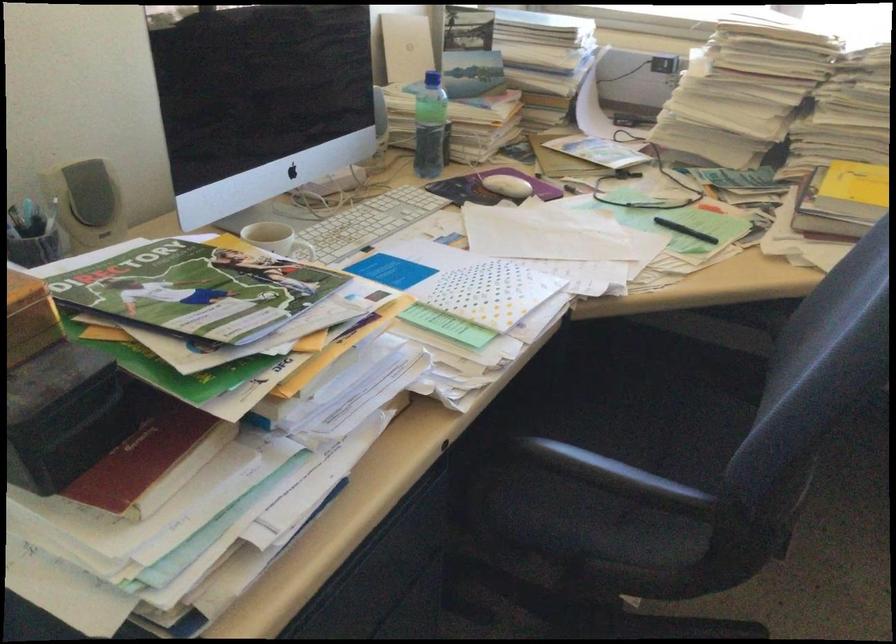
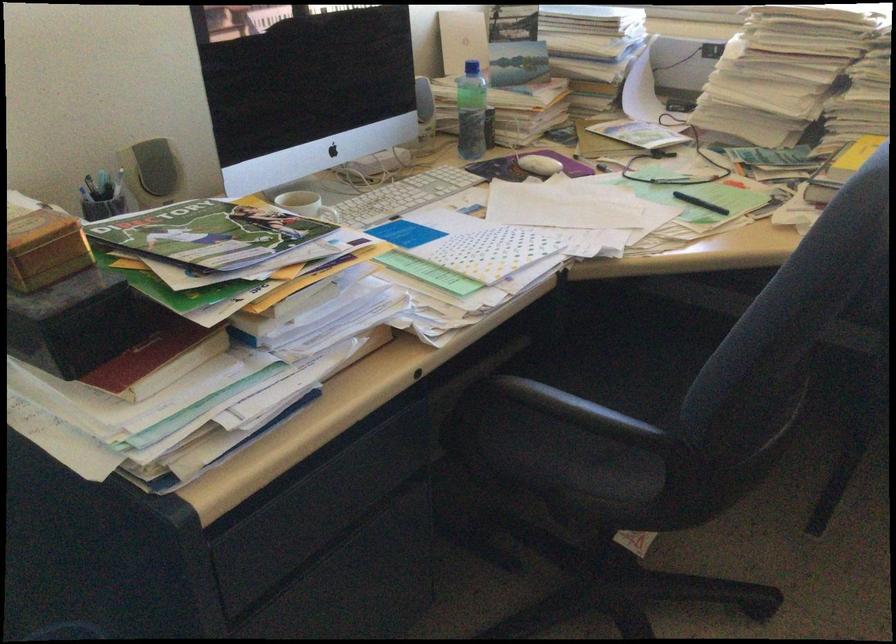
In the second image, find the point that corresponds to (x=609, y=406) in the first image.

(618, 365)